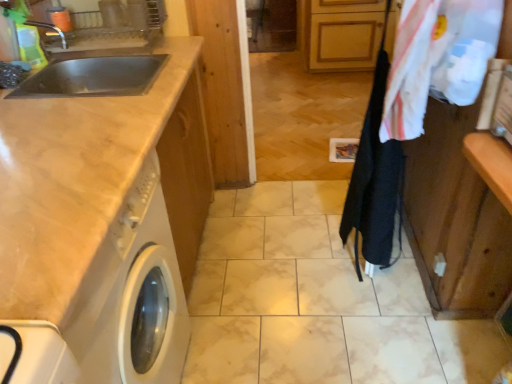
Question: Is white glossy washing machine at left inside white cotton laundry at upper right?

Choices:
 (A) yes
 (B) no

Answer: (B)

Question: From a real-world perspective, is white cotton laundry at upper right located higher than white glossy washing machine at left?

Choices:
 (A) no
 (B) yes

Answer: (B)

Question: Considering the relative sizes of white cotton laundry at upper right and white glossy washing machine at left in the image provided, is white cotton laundry at upper right thinner than white glossy washing machine at left?

Choices:
 (A) yes
 (B) no

Answer: (A)

Question: From the image's perspective, is white cotton laundry at upper right below white glossy washing machine at left?

Choices:
 (A) no
 (B) yes

Answer: (A)

Question: Is white cotton laundry at upper right smaller than white glossy washing machine at left?

Choices:
 (A) no
 (B) yes

Answer: (B)

Question: Do you think matte beige countertop at left is within white cotton laundry at upper right, or outside of it?

Choices:
 (A) inside
 (B) outside

Answer: (B)

Question: Based on their sizes in the image, would you say matte beige countertop at left is bigger or smaller than white cotton laundry at upper right?

Choices:
 (A) big
 (B) small

Answer: (A)

Question: Looking at their shapes, would you say matte beige countertop at left is wider or thinner than white cotton laundry at upper right?

Choices:
 (A) wide
 (B) thin

Answer: (A)

Question: Considering the positions of matte beige countertop at left and white cotton laundry at upper right in the image, is matte beige countertop at left taller or shorter than white cotton laundry at upper right?

Choices:
 (A) tall
 (B) short

Answer: (A)

Question: Based on their positions, is white glossy washing machine at left located to the left or right of black fabric clothesline at center-right?

Choices:
 (A) right
 (B) left

Answer: (B)

Question: Considering the positions of white glossy washing machine at left and black fabric clothesline at center-right in the image, is white glossy washing machine at left taller or shorter than black fabric clothesline at center-right?

Choices:
 (A) short
 (B) tall

Answer: (A)

Question: Looking at the image, does white glossy washing machine at left seem bigger or smaller compared to black fabric clothesline at center-right?

Choices:
 (A) small
 (B) big

Answer: (B)

Question: Is white glossy washing machine at left in front of or behind black fabric clothesline at center-right in the image?

Choices:
 (A) behind
 (B) front

Answer: (B)

Question: Is matte beige countertop at left in front of or behind white glossy washing machine at left in the image?

Choices:
 (A) front
 (B) behind

Answer: (B)

Question: Considering the relative positions of matte beige countertop at left and white glossy washing machine at left in the image provided, is matte beige countertop at left to the left or to the right of white glossy washing machine at left?

Choices:
 (A) right
 (B) left

Answer: (A)